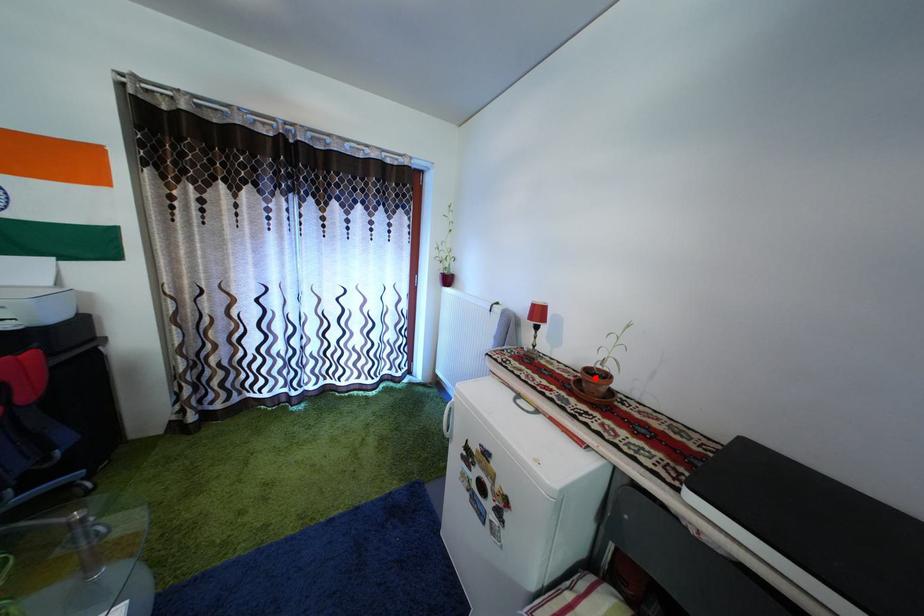
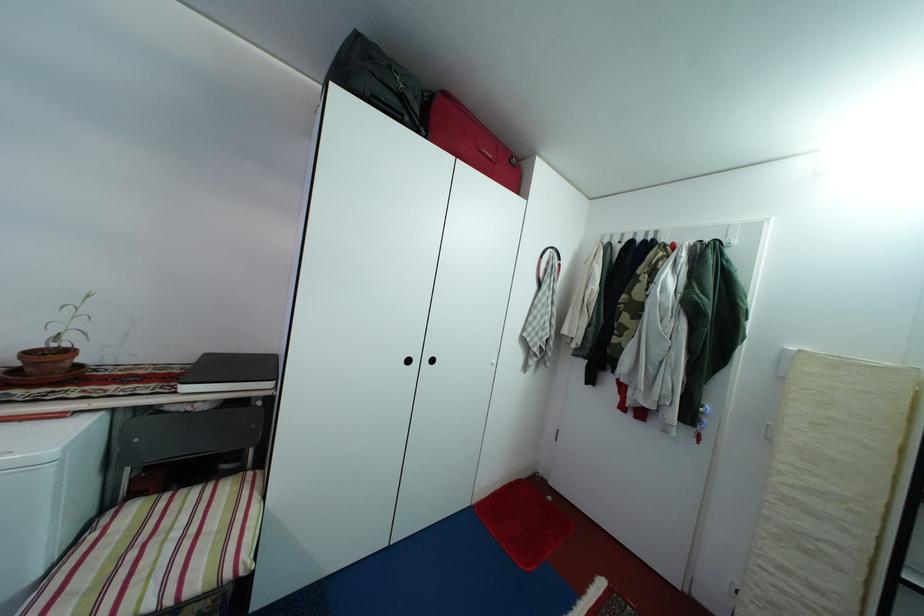
Where in the second image is the point corresponding to the highlighted location from the first image?

(38, 361)